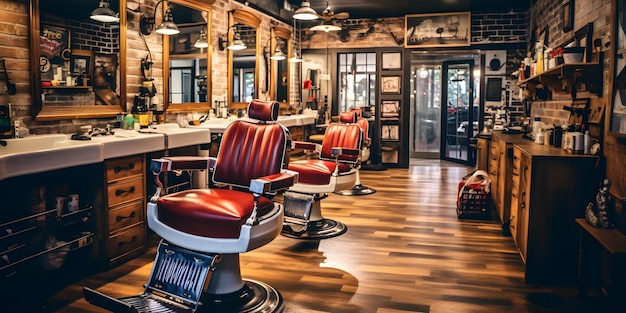
At what (x,y) coordinates should I click in order to perform the action: click on window. Please return your answer as a coordinate pair (x, y). Looking at the image, I should click on (359, 83).